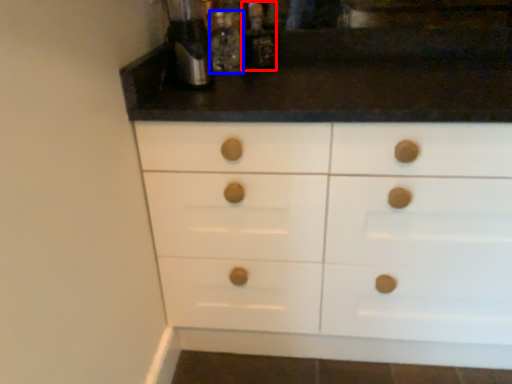
Question: Among these objects, which one is nearest to the camera, bottle (highlighted by a red box) or bottle (highlighted by a blue box)?

Choices:
 (A) bottle
 (B) bottle

Answer: (B)